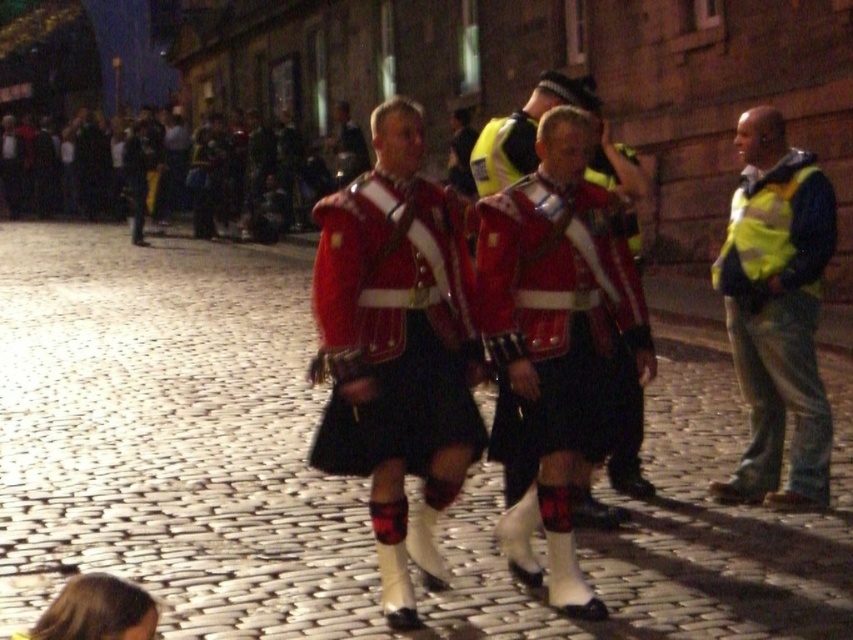
You are a photographer trying to capture both the red woolen kilt at center and the yellow reflective vest at right in the same frame. Since you want to emphasize the size difference between them, which object should you focus on to ensure the one with greater height is properly framed?

The red woolen kilt at center has a greater height compared to the yellow reflective vest at right. To emphasize the size difference, focus on the red woolen kilt at center as it is taller, ensuring it occupies a prominent position in the frame while still including the yellow reflective vest at right in the background or periphery.

You are a photographer trying to capture both the red woolen kilt at center and the red velvet kilt at center in the same frame. Since you want to highlight their differences in material, which kilt should you focus on first to ensure the texture stands out more?

The red velvet kilt at center has a thicker material compared to the red woolen kilt at center, so focusing on the red velvet kilt at center first will better highlight its textured appearance.